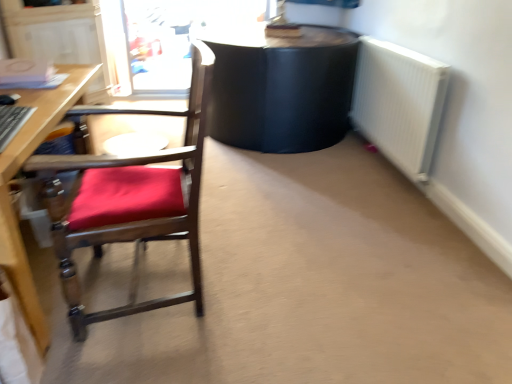
The width and height of the screenshot is (512, 384). Identify the location of free space that is to the left of white metallic radiator at right. (310, 170).